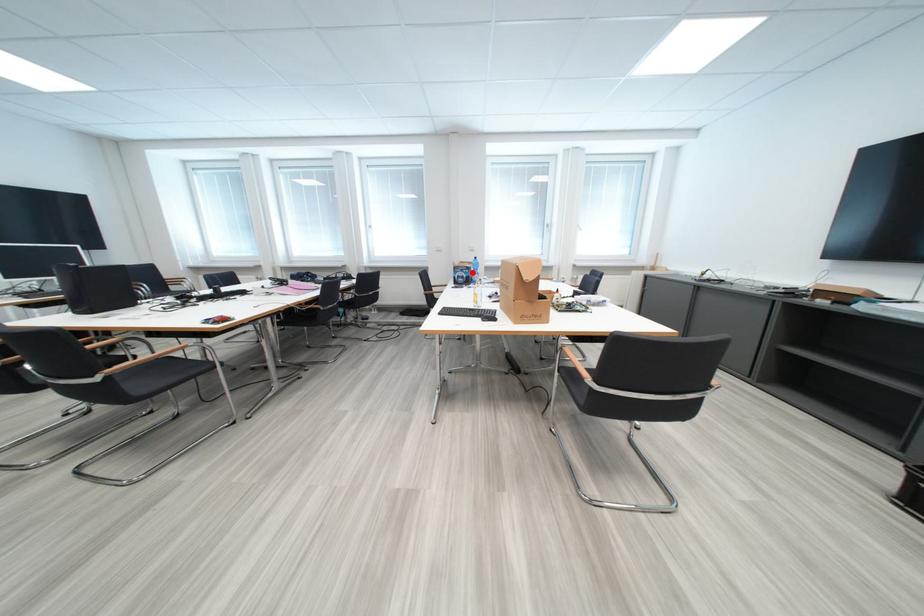
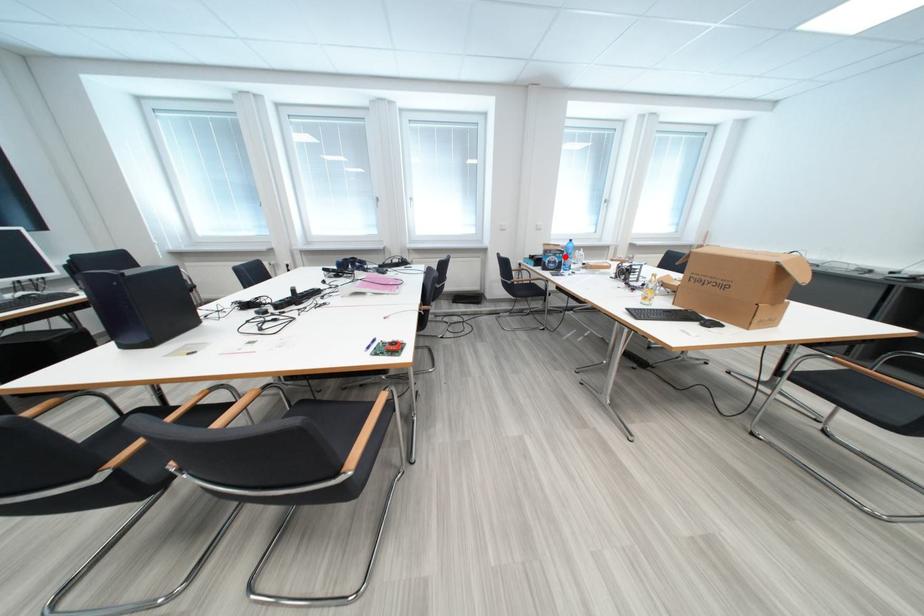
I am providing you with two images of the same scene from different viewpoints. A red point is marked on the first image and another point is marked on the second image. Is the marked point in image1 the same physical position as the marked point in image2?

Yes